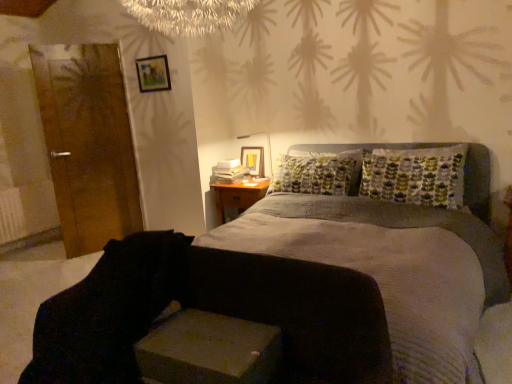
Question: Is the depth of textured gray bed at center less than that of black fabric swivel chair at lower left?

Choices:
 (A) no
 (B) yes

Answer: (B)

Question: Considering the relative positions of textured gray bed at center and black fabric swivel chair at lower left in the image provided, is textured gray bed at center to the left of black fabric swivel chair at lower left from the viewer's perspective?

Choices:
 (A) no
 (B) yes

Answer: (A)

Question: From a real-world perspective, does textured gray bed at center stand above black fabric swivel chair at lower left?

Choices:
 (A) no
 (B) yes

Answer: (A)

Question: Considering the relative positions of textured gray bed at center and black fabric swivel chair at lower left in the image provided, is textured gray bed at center to the right of black fabric swivel chair at lower left from the viewer's perspective?

Choices:
 (A) no
 (B) yes

Answer: (B)

Question: Is textured gray bed at center far away from black fabric swivel chair at lower left?

Choices:
 (A) no
 (B) yes

Answer: (A)

Question: From the image's perspective, is textured gray bed at center located beneath black fabric swivel chair at lower left?

Choices:
 (A) no
 (B) yes

Answer: (A)

Question: Considering the relative sizes of white plastic table lamp at upper center and wooden door at left in the image provided, is white plastic table lamp at upper center smaller than wooden door at left?

Choices:
 (A) yes
 (B) no

Answer: (A)

Question: Considering the relative sizes of white plastic table lamp at upper center and wooden door at left in the image provided, is white plastic table lamp at upper center taller than wooden door at left?

Choices:
 (A) no
 (B) yes

Answer: (A)

Question: From a real-world perspective, is white plastic table lamp at upper center physically below wooden door at left?

Choices:
 (A) yes
 (B) no

Answer: (A)

Question: Would you consider white plastic table lamp at upper center to be distant from wooden door at left?

Choices:
 (A) yes
 (B) no

Answer: (A)

Question: Considering the relative sizes of white plastic table lamp at upper center and wooden door at left in the image provided, is white plastic table lamp at upper center bigger than wooden door at left?

Choices:
 (A) yes
 (B) no

Answer: (B)

Question: Considering the relative positions of white plastic table lamp at upper center and wooden door at left in the image provided, is white plastic table lamp at upper center to the left of wooden door at left from the viewer's perspective?

Choices:
 (A) yes
 (B) no

Answer: (B)

Question: Can you confirm if black fabric swivel chair at lower left is wider than wooden door at left?

Choices:
 (A) yes
 (B) no

Answer: (A)